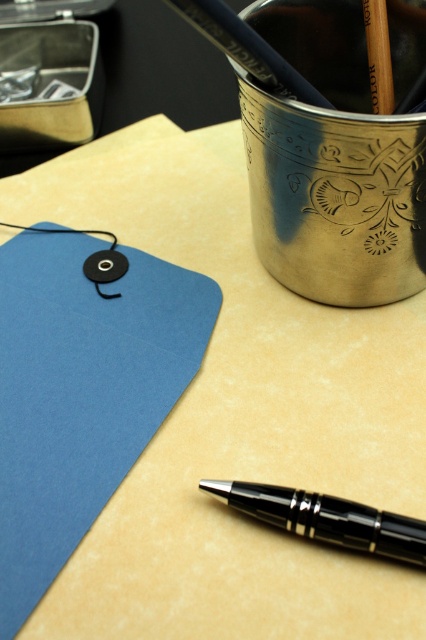
Does matte blue paper at upper left have a smaller size compared to black polished pen at lower right?

No.

Which is behind, point (144, 433) or point (363, 529)?

The point (144, 433) is more distant.

Is point (94, 362) in front of point (419, 556)?

No, (94, 362) is further to viewer.

Find the location of a particular element. This screenshot has height=640, width=426. matte blue paper at upper left is located at coordinates (81, 388).